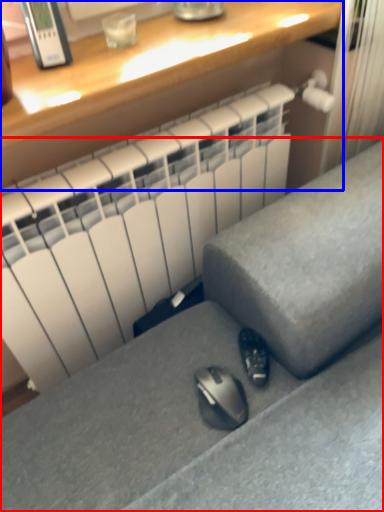
Question: Which object appears closest to the camera in this image, furniture (highlighted by a red box) or desk (highlighted by a blue box)?

Choices:
 (A) furniture
 (B) desk

Answer: (A)